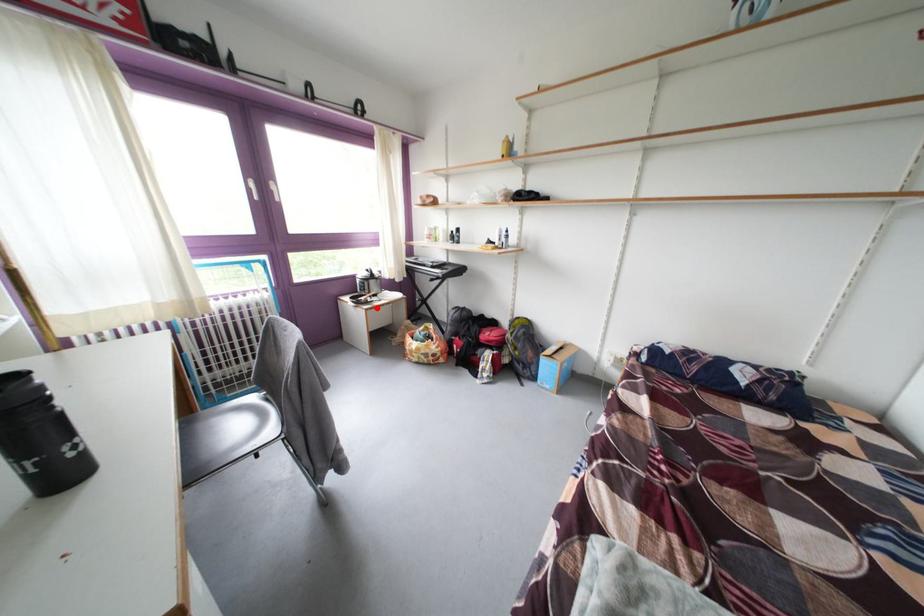
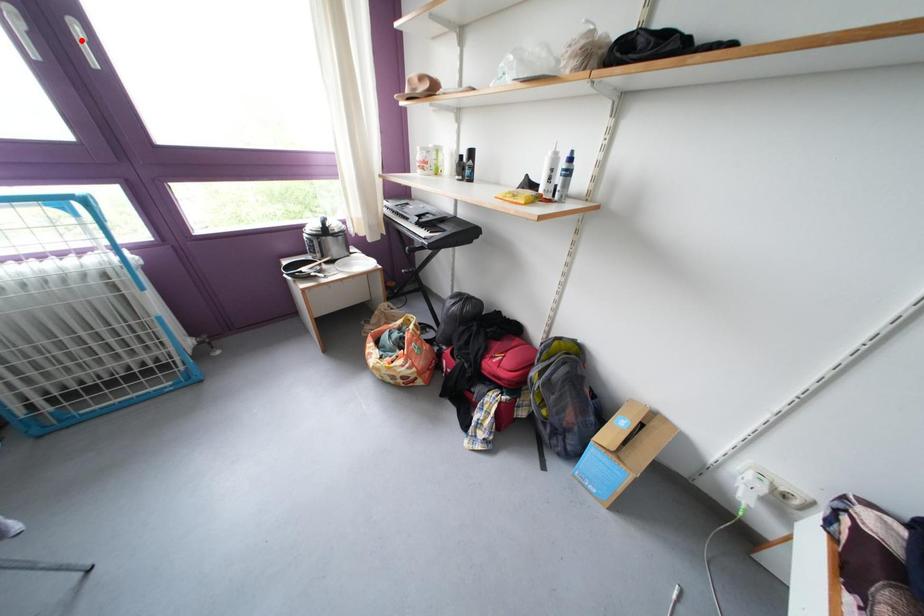
I am providing you with two images of the same scene from different viewpoints. A red point is marked on the first image and another point is marked on the second image. Is the marked point in image1 the same physical position as the marked point in image2?

No